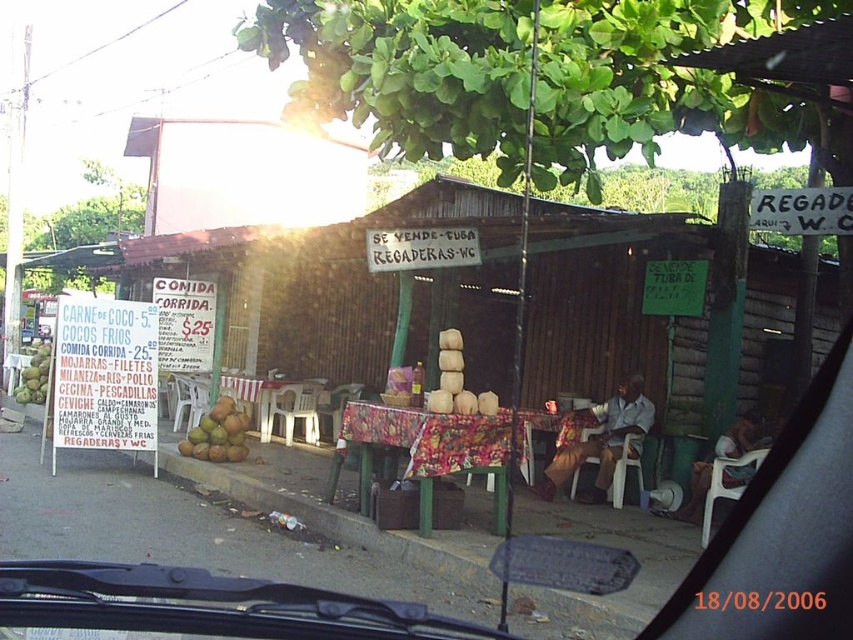
You are standing in front of the food stall and want to point out two specific points mentioned in the scene. Which of the two points, point (251, 605) or point (352, 412), is closer to you?

Point (251, 605) is closer to the viewer than point (352, 412).